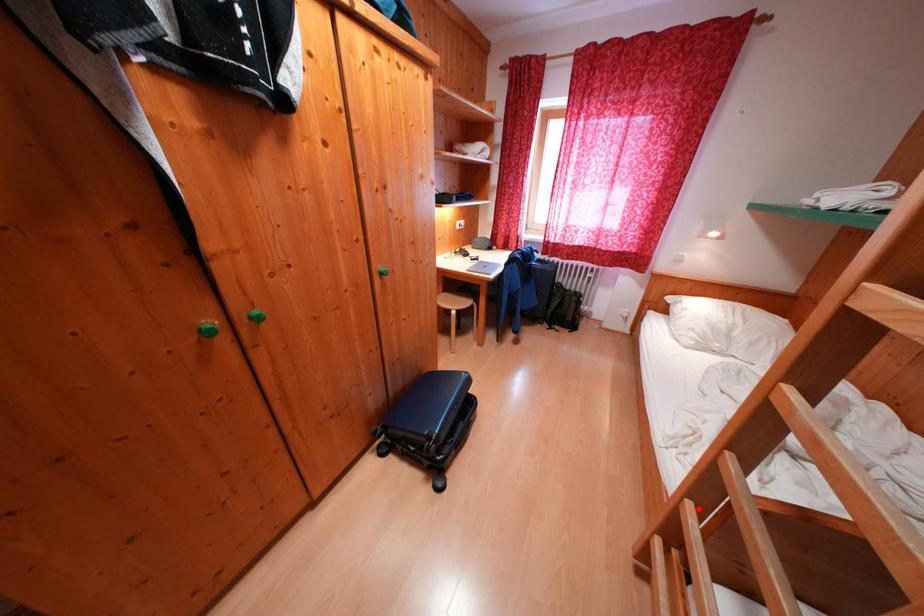
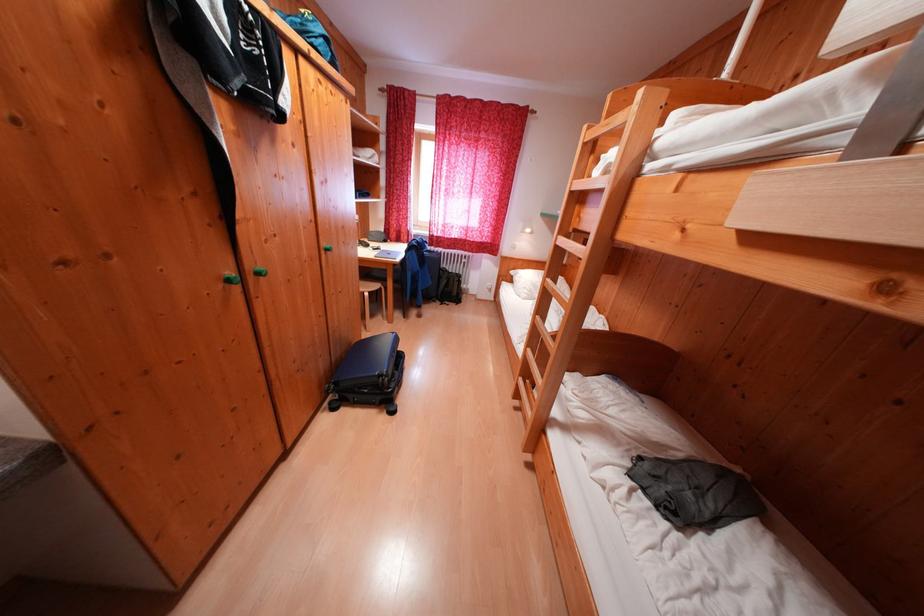
Question: I am providing you with two images of the same scene from different viewpoints. In image1, a red point is highlighted. Considering the same 3D point in image2, which of the following is correct?

Choices:
 (A) It is closer
 (B) It is farther

Answer: (A)